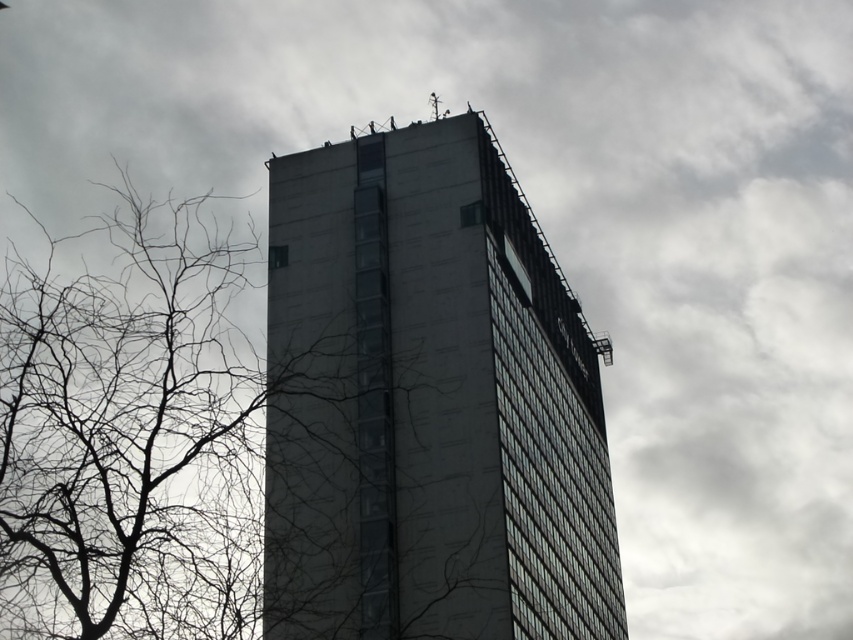
In order to click on dark gray concrete building at center in this screenshot , I will do `click(428, 403)`.

Between point (543, 426) and point (113, 216), which one is positioned behind?

The point (113, 216) is behind.

Between point (463, 236) and point (44, 337), which one is positioned behind?

Point (463, 236)

At what (x,y) coordinates should I click in order to perform the action: click on dark gray concrete building at center. Please return your answer as a coordinate pair (x, y). Image resolution: width=853 pixels, height=640 pixels. Looking at the image, I should click on (428, 403).